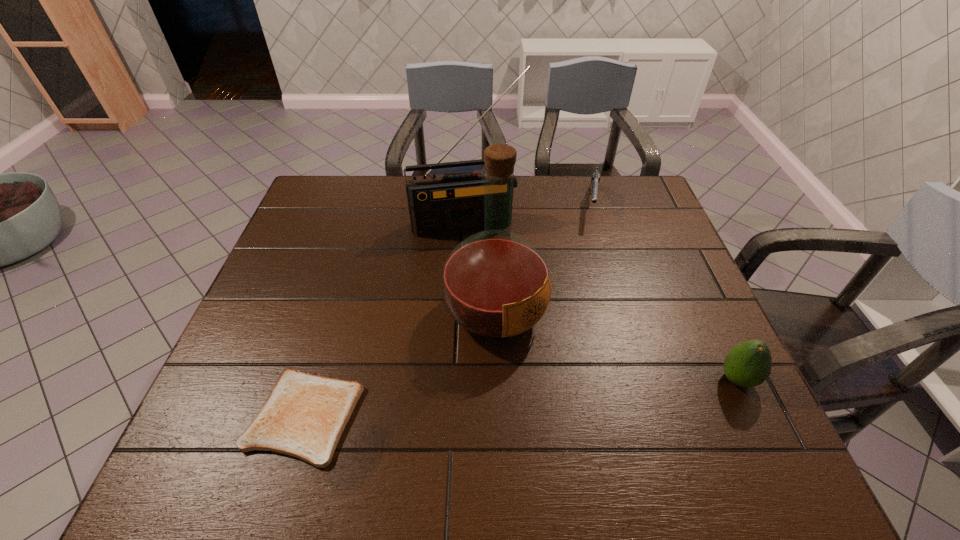
You are a GUI agent. You are given a task and a screenshot of the screen. Output one action in this format:
    pyautogui.click(x=<x>, y=<y>)
    Task: Click on the vacant space on the desktop that is between the shortest object and the rightmost object and is positioned on the front-facing side of the radio receiver
    The height and width of the screenshot is (540, 960).
    Given the screenshot: What is the action you would take?
    pyautogui.click(x=510, y=399)

I want to click on vacant spot on the desktop that is between the toast and the third tallest object and is positioned on the front label of the third farthest object, so click(588, 392).

The height and width of the screenshot is (540, 960). What are the coordinates of `vacant space on the desktop that is between the shortest object and the third shortest object and is positioned aiming along the barrel of the fourth object from left to right` in the screenshot? It's located at (575, 393).